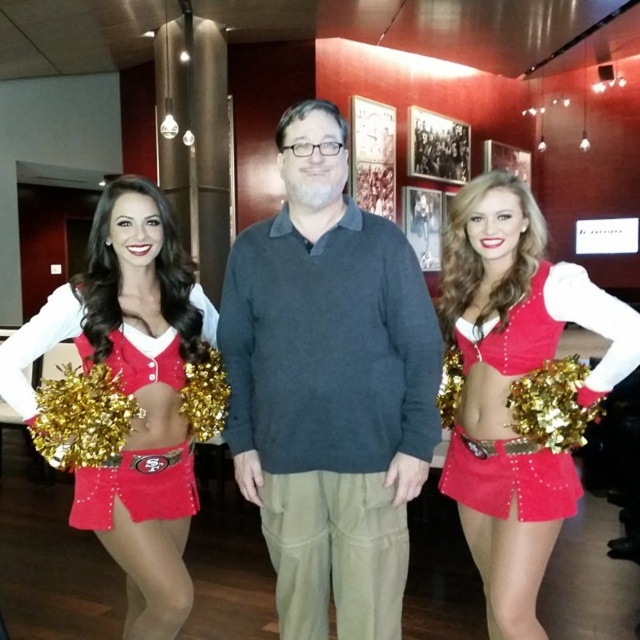
Question: Which of the following is the farthest from the observer?

Choices:
 (A) matte red cheerleader at center
 (B) matte red cheerleader at left
 (C) matte red cheerleader outfit at right
 (D) red velvet cheerleader outfit at left

Answer: (D)

Question: Can you confirm if matte red cheerleader at center is positioned to the left of red velvet cheerleader outfit at left?

Choices:
 (A) yes
 (B) no

Answer: (B)

Question: Considering the real-world distances, which object is farthest from the dark gray sweater at center?

Choices:
 (A) matte red cheerleader at center
 (B) matte red cheerleader outfit at right
 (C) matte red cheerleader at left
 (D) red velvet cheerleader outfit at left

Answer: (A)

Question: Does matte red cheerleader at center appear on the right side of matte red cheerleader outfit at right?

Choices:
 (A) no
 (B) yes

Answer: (B)

Question: Among these objects, which one is nearest to the camera?

Choices:
 (A) matte red cheerleader at left
 (B) matte red cheerleader at center
 (C) dark gray sweater at center

Answer: (B)

Question: Can you confirm if matte red cheerleader at center is positioned below matte red cheerleader at left?

Choices:
 (A) yes
 (B) no

Answer: (B)